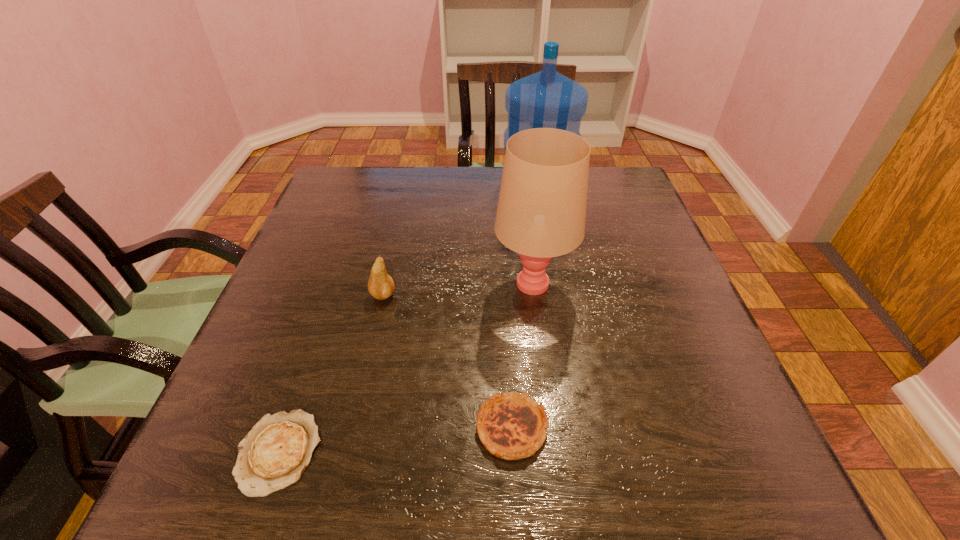
The image size is (960, 540). What are the coordinates of `water jug` in the screenshot? It's located at (547, 99).

Where is `the fourth shortest object`? The width and height of the screenshot is (960, 540). the fourth shortest object is located at coordinates (541, 212).

The width and height of the screenshot is (960, 540). I want to click on the second object from left to right, so click(381, 286).

Locate an element on the screen. This screenshot has width=960, height=540. the third tallest object is located at coordinates (381, 286).

You are a GUI agent. You are given a task and a screenshot of the screen. Output one action in this format:
    pyautogui.click(x=<x>, y=<y>)
    Task: Click on the taller quiche
    The width and height of the screenshot is (960, 540).
    Given the screenshot: What is the action you would take?
    pyautogui.click(x=511, y=426)

You are a GUI agent. You are given a task and a screenshot of the screen. Output one action in this format:
    pyautogui.click(x=<x>, y=<y>)
    Task: Click on the right quiche
    
    Given the screenshot: What is the action you would take?
    pyautogui.click(x=511, y=426)

In order to click on the shorter quiche in this screenshot , I will do `click(273, 455)`.

The image size is (960, 540). In order to click on the shortest object in this screenshot , I will do `click(273, 455)`.

This screenshot has width=960, height=540. I want to click on vacant space located on the right of the farthest object, so click(605, 185).

Locate an element on the screen. blank space located 0.350m on the left of the lampshade is located at coordinates (334, 282).